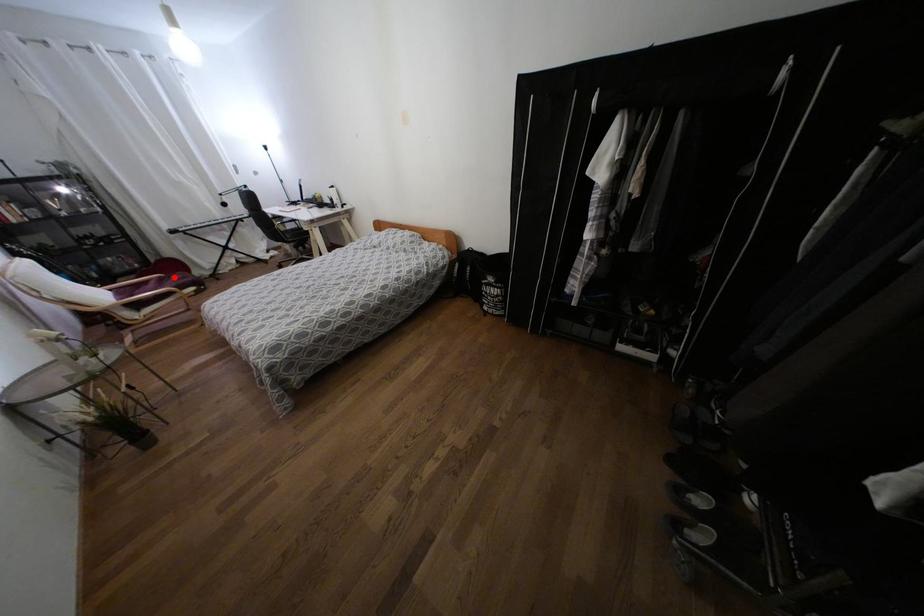
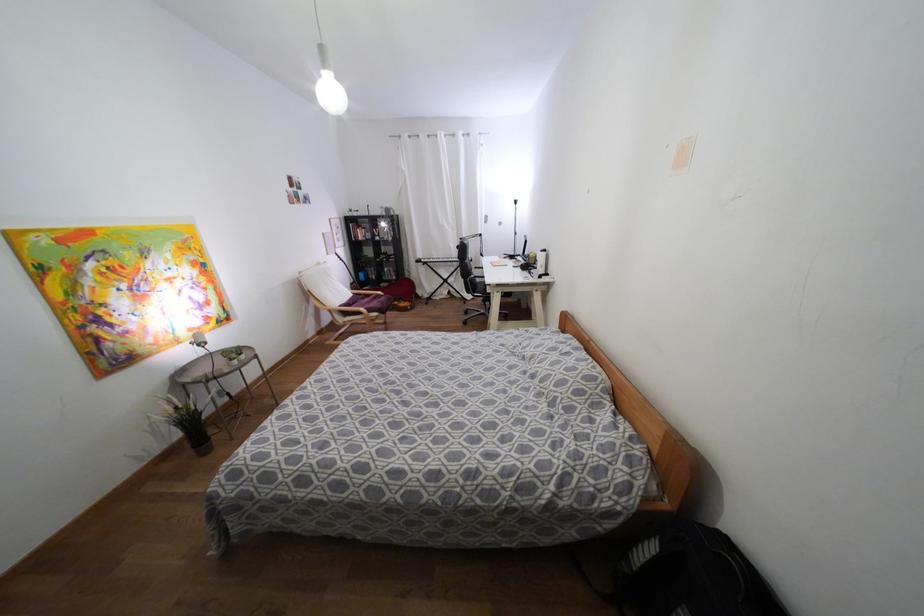
Locate, in the second image, the point that corresponds to the highlighted location in the first image.

(382, 299)